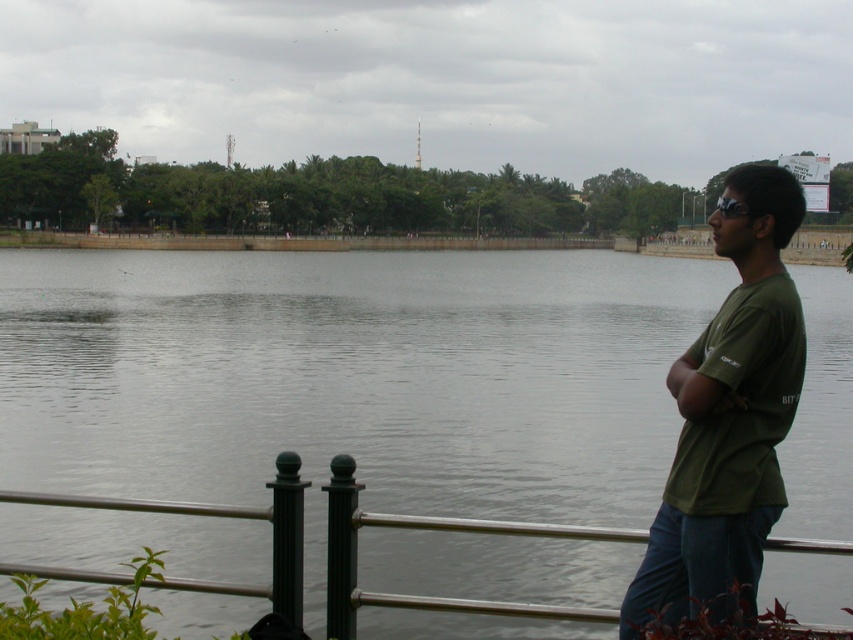
Which is more to the right, gray water at center or black matte goggles at upper right?

black matte goggles at upper right

The height and width of the screenshot is (640, 853). In order to click on gray water at center in this screenshot , I will do `click(349, 378)`.

You are a GUI agent. You are given a task and a screenshot of the screen. Output one action in this format:
    pyautogui.click(x=<x>, y=<y>)
    Task: Click on the gray water at center
    This screenshot has width=853, height=640.
    Given the screenshot: What is the action you would take?
    pyautogui.click(x=349, y=378)

Is point (263, 268) farther from camera compared to point (714, 484)?

That is True.

Can you confirm if gray water at center is thinner than green matte shirt at right?

No.

I want to click on gray water at center, so point(349,378).

Find the location of a particular element. This screenshot has width=853, height=640. gray water at center is located at coordinates (349, 378).

Is point (689, 573) in front of point (735, 200)?

Yes, point (689, 573) is closer to viewer.

Between green matte shirt at right and black matte goggles at upper right, which one is positioned lower?

green matte shirt at right

Describe the element at coordinates (729, 419) in the screenshot. I see `green matte shirt at right` at that location.

The height and width of the screenshot is (640, 853). I want to click on green matte shirt at right, so click(729, 419).